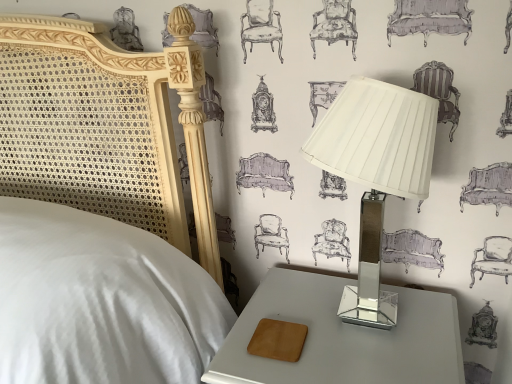
Where is `free spot in front of metallic silver lamp at right`? free spot in front of metallic silver lamp at right is located at coordinates (377, 365).